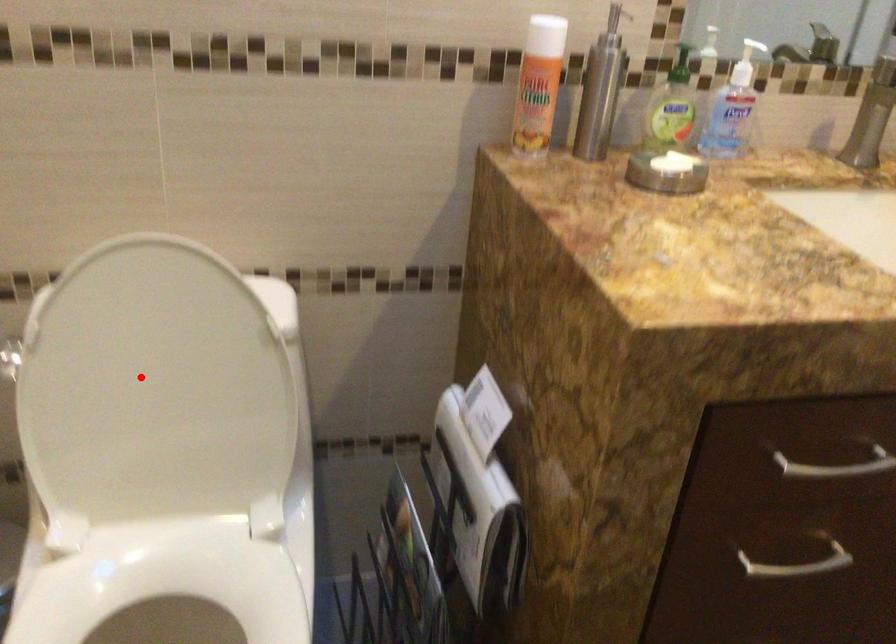
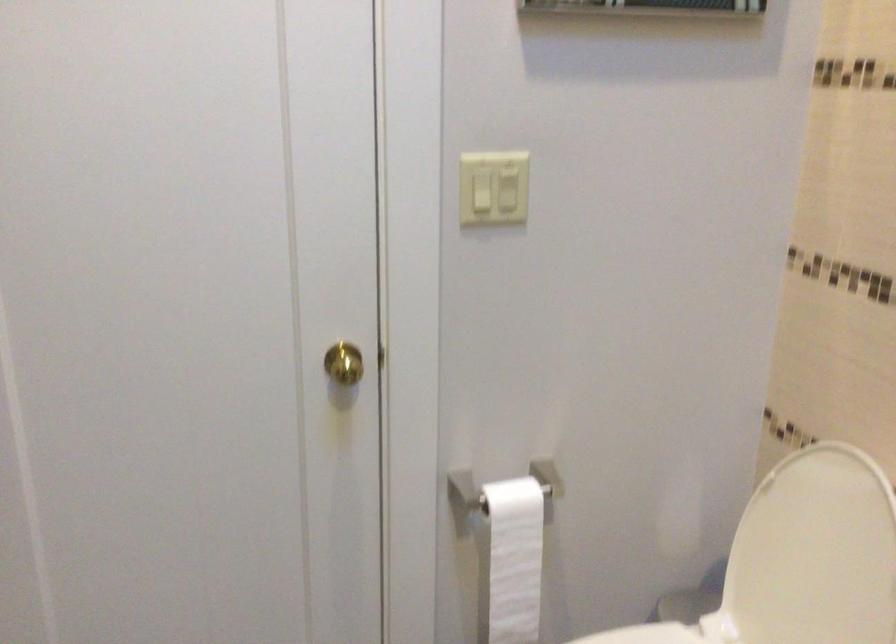
Where in the second image is the point corresponding to the highlighted location from the first image?

(813, 554)